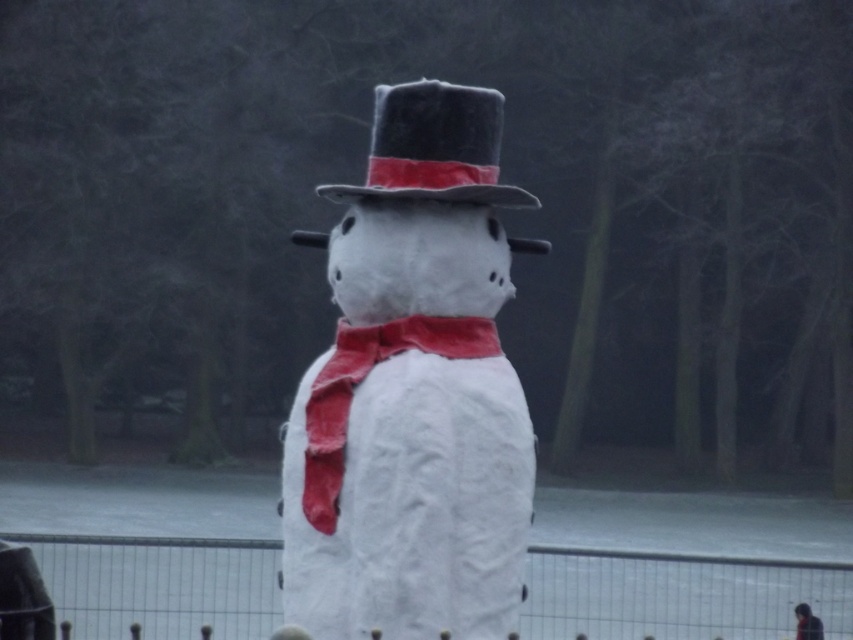
Can you confirm if white paper snowman at center is smaller than red fabric bow tie at center?

No.

Between white paper snowman at center and red fabric bow tie at center, which one has more height?

white paper snowman at center

Is point (519, 509) closer to viewer compared to point (337, 493)?

That is False.

Image resolution: width=853 pixels, height=640 pixels. I want to click on white paper snowman at center, so click(x=413, y=392).

Does white paper snowman at center have a larger size compared to dark gray fabric coat at lower right?

Indeed, white paper snowman at center has a larger size compared to dark gray fabric coat at lower right.

In the scene shown: Which is below, white paper snowman at center or dark gray fabric coat at lower right?

dark gray fabric coat at lower right is lower down.

Identify the location of white paper snowman at center. (413, 392).

Which of these two, red fabric bow tie at center or dark gray fabric coat at lower right, stands taller?

red fabric bow tie at center

Does red fabric bow tie at center come behind dark gray fabric coat at lower right?

No, red fabric bow tie at center is in front of dark gray fabric coat at lower right.

The height and width of the screenshot is (640, 853). I want to click on red fabric bow tie at center, so click(360, 381).